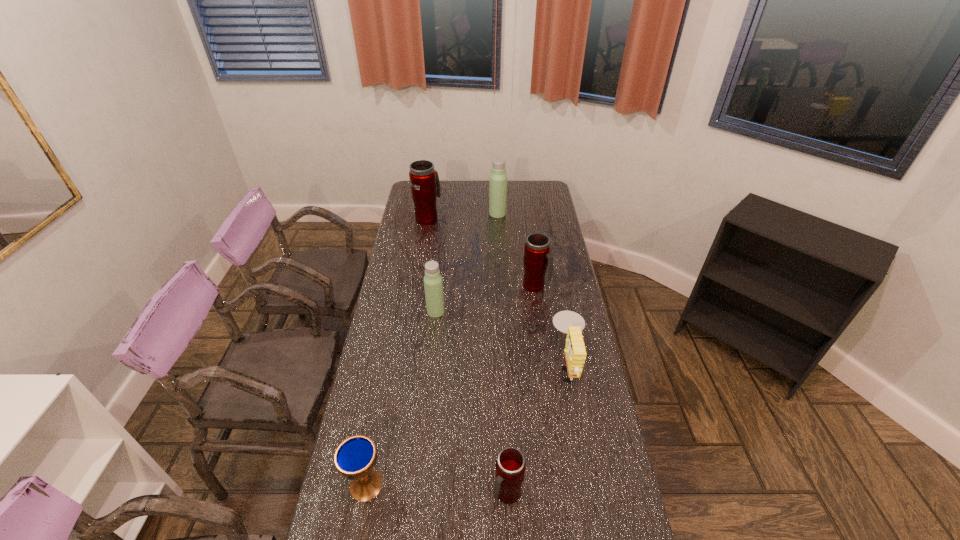
What are the coordinates of `the farthest red thermos bottle` in the screenshot? It's located at (425, 186).

Locate an element on the screen. The height and width of the screenshot is (540, 960). the biggest red thermos bottle is located at coordinates (425, 186).

Locate an element on the screen. Image resolution: width=960 pixels, height=540 pixels. the bigger light thermos bottle is located at coordinates (498, 178).

Where is `the farther light thermos bottle`? The image size is (960, 540). the farther light thermos bottle is located at coordinates (498, 178).

At what (x,y) coordinates should I click in order to perform the action: click on the third nearest thermos bottle. Please return your answer as a coordinate pair (x, y). Looking at the image, I should click on (537, 257).

You are a GUI agent. You are given a task and a screenshot of the screen. Output one action in this format:
    pyautogui.click(x=<x>, y=<y>)
    Task: Click on the rightmost red thermos bottle
    
    Given the screenshot: What is the action you would take?
    pyautogui.click(x=537, y=257)

The height and width of the screenshot is (540, 960). Find the location of `the fourth farthest thermos bottle`. the fourth farthest thermos bottle is located at coordinates (433, 284).

Find the location of a particular element. Image resolution: width=960 pixels, height=540 pixels. the fourth farthest object is located at coordinates (433, 284).

Where is `sponge`? This screenshot has height=540, width=960. sponge is located at coordinates (569, 322).

This screenshot has height=540, width=960. I want to click on yellow sponge, so click(569, 322).